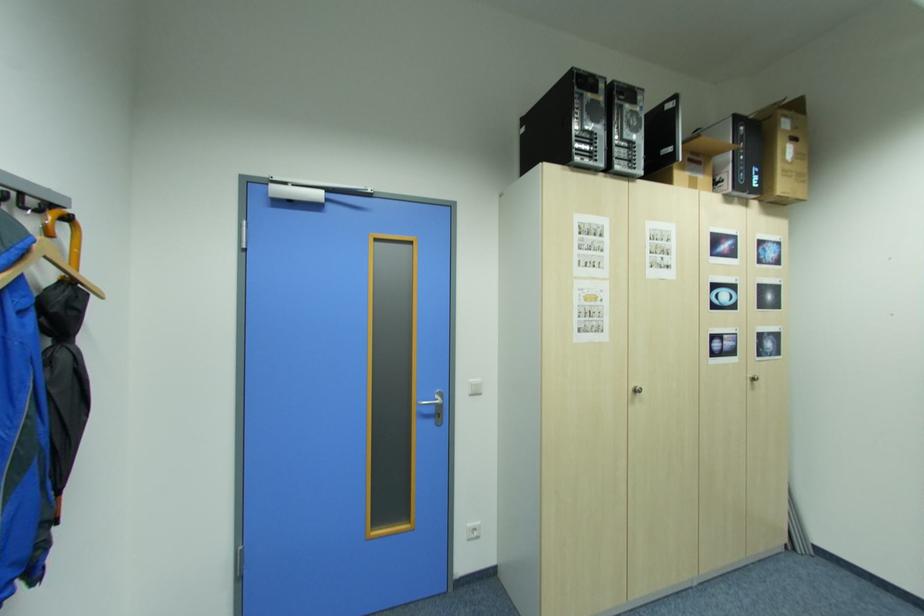
This screenshot has width=924, height=616. Identify the location of white power outlet. (472, 531).